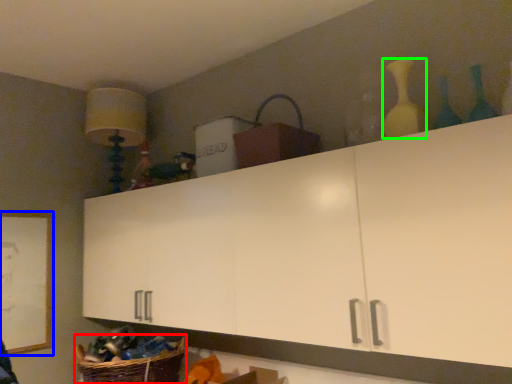
Question: Which object is positioned closest to basket (highlighted by a red box)? Select from picture frame (highlighted by a blue box) and bottle (highlighted by a green box).

Choices:
 (A) picture frame
 (B) bottle

Answer: (A)